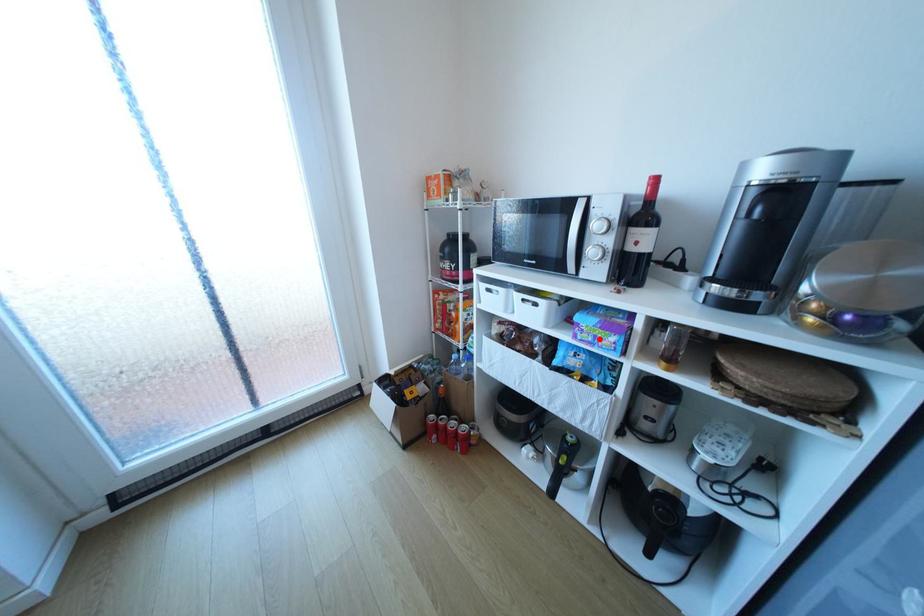
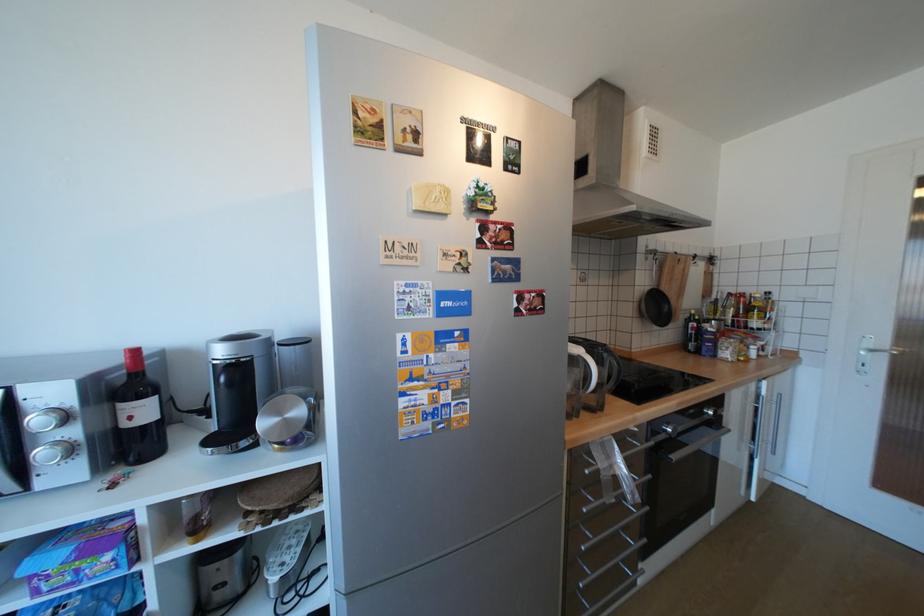
Question: I am providing you with two images of the same scene from different viewpoints. A red point is shown in image1. For the corresponding object point in image2, is it positioned nearer or farther from the camera?

Choices:
 (A) Nearer
 (B) Farther

Answer: (A)